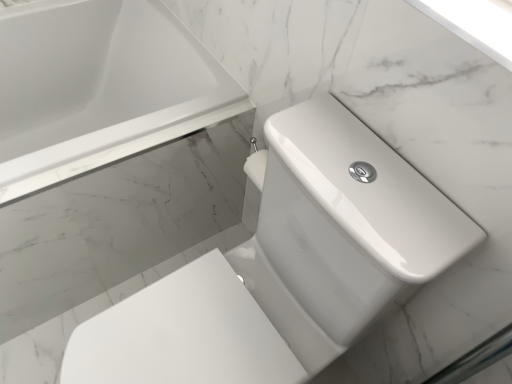
Identify the location of white glossy bathtub at upper left. The width and height of the screenshot is (512, 384). (99, 87).

Describe the element at coordinates (99, 87) in the screenshot. I see `white glossy bathtub at upper left` at that location.

What do you see at coordinates (288, 267) in the screenshot? The height and width of the screenshot is (384, 512). I see `white glossy toilet at center-right` at bounding box center [288, 267].

In order to click on white glossy toilet at center-right in this screenshot , I will do `click(288, 267)`.

Where is `white glossy bathtub at upper left`? white glossy bathtub at upper left is located at coordinates (99, 87).

Consider the image. Which object is positioned more to the left, white glossy toilet at center-right or white glossy bathtub at upper left?

From the viewer's perspective, white glossy bathtub at upper left appears more on the left side.

Does white glossy toilet at center-right come behind white glossy bathtub at upper left?

No, it is not.

Is point (246, 367) closer or farther from the camera than point (5, 122)?

Point (246, 367) is closer to the camera than point (5, 122).

From the image's perspective, is white glossy toilet at center-right beneath white glossy bathtub at upper left?

Yes, from the image's perspective, white glossy toilet at center-right is beneath white glossy bathtub at upper left.

From a real-world perspective, who is located higher, white glossy toilet at center-right or white glossy bathtub at upper left?

white glossy toilet at center-right.

Considering the sizes of white glossy toilet at center-right and white glossy bathtub at upper left in the image, is white glossy toilet at center-right wider or thinner than white glossy bathtub at upper left?

Clearly, white glossy toilet at center-right has more width compared to white glossy bathtub at upper left.

Considering the sizes of objects white glossy toilet at center-right and white glossy bathtub at upper left in the image provided, who is taller, white glossy toilet at center-right or white glossy bathtub at upper left?

With more height is white glossy toilet at center-right.

Considering the sizes of objects white glossy toilet at center-right and white glossy bathtub at upper left in the image provided, who is smaller, white glossy toilet at center-right or white glossy bathtub at upper left?

With smaller size is white glossy toilet at center-right.

Is white glossy toilet at center-right outside of white glossy bathtub at upper left?

white glossy toilet at center-right lies outside white glossy bathtub at upper left's area.

Looking at this image, are white glossy toilet at center-right and white glossy bathtub at upper left beside each other?

No.

Does white glossy toilet at center-right turn towards white glossy bathtub at upper left?

No.

Looking at this image, how different are the orientations of white glossy toilet at center-right and white glossy bathtub at upper left in degrees?

The angular difference between white glossy toilet at center-right and white glossy bathtub at upper left is 90.1 degrees.

Where is `bathtub on the left of white glossy toilet at center-right`? This screenshot has height=384, width=512. bathtub on the left of white glossy toilet at center-right is located at coordinates (99, 87).

Visually, is white glossy bathtub at upper left positioned to the left or to the right of white glossy toilet at center-right?

Clearly, white glossy bathtub at upper left is on the left of white glossy toilet at center-right in the image.

Which object is further away from the camera taking this photo, white glossy bathtub at upper left or white glossy toilet at center-right?

Positioned behind is white glossy bathtub at upper left.

Does point (16, 116) come farther from viewer compared to point (265, 322)?

Yes, it is.

From the image's perspective, is white glossy bathtub at upper left on white glossy toilet at center-right?

Yes.

From a real-world perspective, relative to white glossy toilet at center-right, is white glossy bathtub at upper left vertically above or below?

white glossy bathtub at upper left is situated lower than white glossy toilet at center-right in the real world.

Is white glossy bathtub at upper left wider than white glossy toilet at center-right?

Incorrect, the width of white glossy bathtub at upper left does not surpass that of white glossy toilet at center-right.

Does white glossy bathtub at upper left have a lesser height compared to white glossy toilet at center-right?

Yes.

Is white glossy bathtub at upper left smaller than white glossy toilet at center-right?

No.

Could white glossy toilet at center-right be considered to be inside white glossy bathtub at upper left?

Definitely not — white glossy toilet at center-right is not inside white glossy bathtub at upper left.

Can you see white glossy bathtub at upper left touching white glossy toilet at center-right?

No, white glossy bathtub at upper left is not with white glossy toilet at center-right.

Is white glossy bathtub at upper left oriented away from white glossy toilet at center-right?

That's not correct — white glossy bathtub at upper left is not looking away from white glossy toilet at center-right.

Can you tell me how much white glossy bathtub at upper left and white glossy toilet at center-right differ in facing direction?

The facing directions of white glossy bathtub at upper left and white glossy toilet at center-right are 90.1 degrees apart.

Measure the distance between white glossy bathtub at upper left and white glossy toilet at center-right.

white glossy bathtub at upper left is 23.12 inches from white glossy toilet at center-right.

Locate an element on the screen. This screenshot has height=384, width=512. bathtub below the white glossy toilet at center-right (from a real-world perspective) is located at coordinates (99, 87).

Where is `bathtub lying above the white glossy toilet at center-right (from the image's perspective)`? The image size is (512, 384). bathtub lying above the white glossy toilet at center-right (from the image's perspective) is located at coordinates (99, 87).

The image size is (512, 384). What are the coordinates of `bathtub on the left of white glossy toilet at center-right` in the screenshot? It's located at (99, 87).